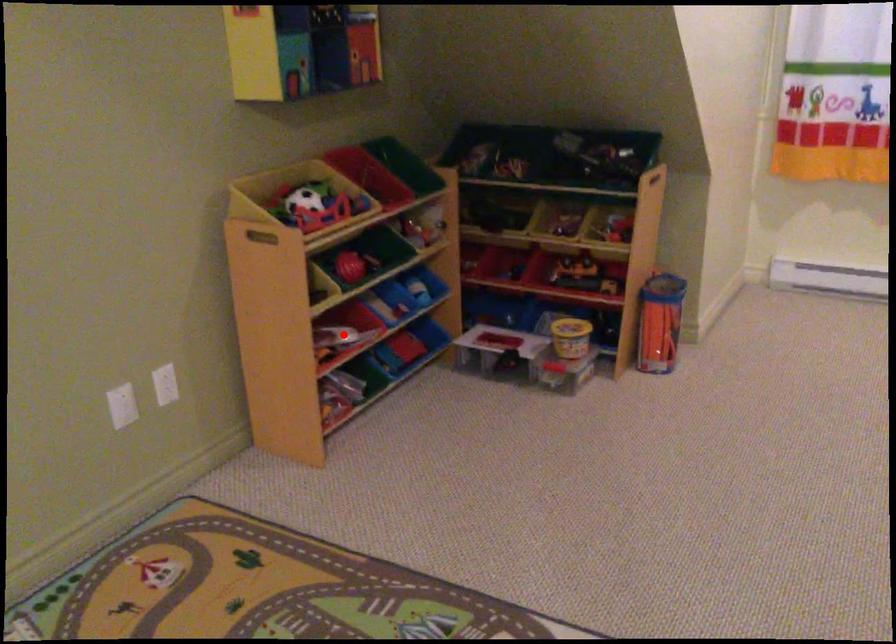
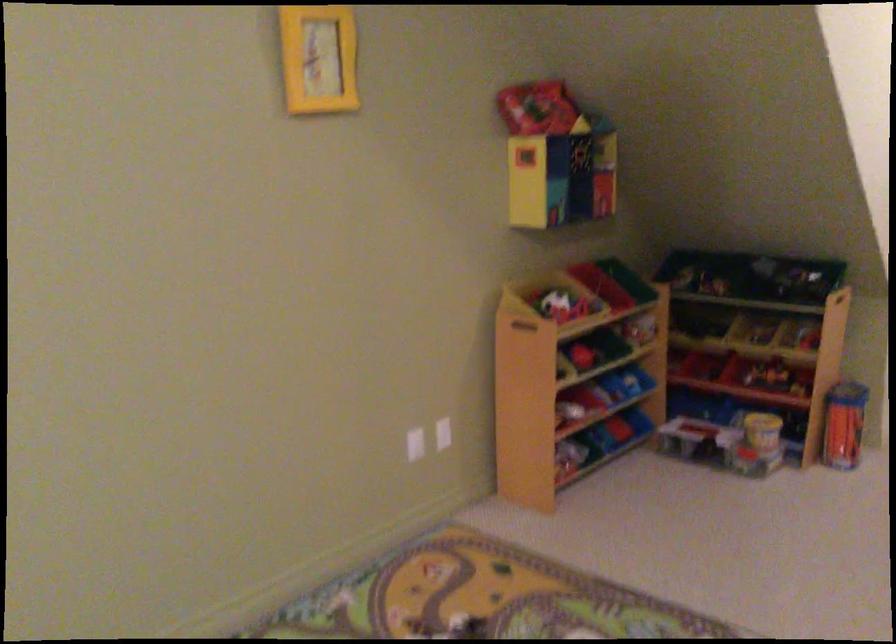
Question: I am providing you with two images of the same scene from different viewpoints. A red point is shown in image1. For the corresponding object point in image2, is it positioned nearer or farther from the camera?

Choices:
 (A) Nearer
 (B) Farther

Answer: (B)